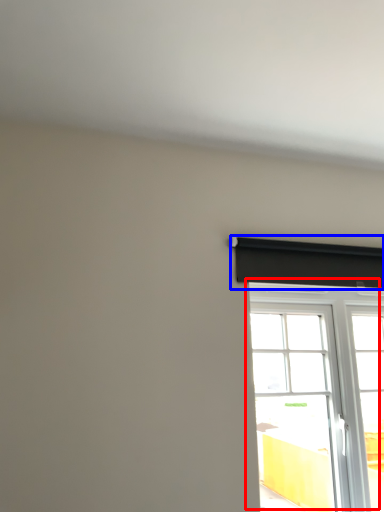
Question: Which object is further to the camera taking this photo, window (highlighted by a red box) or curtain (highlighted by a blue box)?

Choices:
 (A) window
 (B) curtain

Answer: (B)